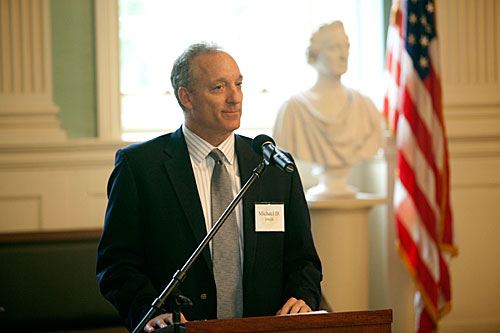
The image size is (500, 333). In order to click on wall in this screenshot , I will do `click(14, 20)`.